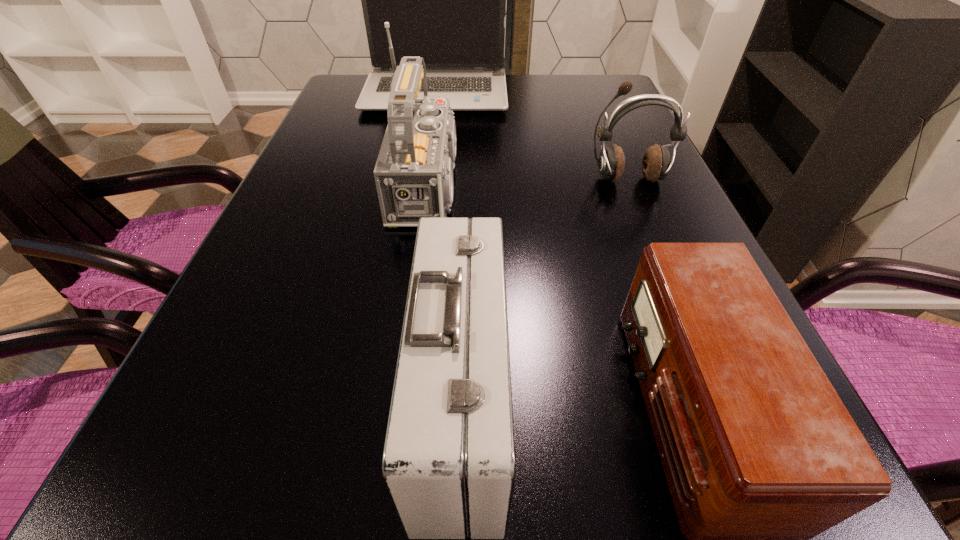
Find the location of a particular element. The width and height of the screenshot is (960, 540). the farthest object is located at coordinates (445, 0).

The image size is (960, 540). What are the coordinates of `the left radio receiver` in the screenshot? It's located at (413, 174).

Identify the location of the taller radio receiver. Image resolution: width=960 pixels, height=540 pixels. (413, 174).

Where is `earphone`? earphone is located at coordinates (656, 163).

Identify the location of free space located 0.170m on the screen of the farthest object. Image resolution: width=960 pixels, height=540 pixels. (426, 151).

Where is `vacant area situated on the front-facing side of the taller radio receiver`? vacant area situated on the front-facing side of the taller radio receiver is located at coordinates (594, 186).

I want to click on vacant space situated 0.050m on the ear pads of the earphone, so click(637, 204).

Identify the location of object located at the far edge. (445, 0).

The width and height of the screenshot is (960, 540). I want to click on object present at the left edge, so click(445, 0).

At what (x,y) coordinates should I click in order to perform the action: click on object that is at the right edge. Please return your answer as a coordinate pair (x, y). This screenshot has height=540, width=960. Looking at the image, I should click on (656, 163).